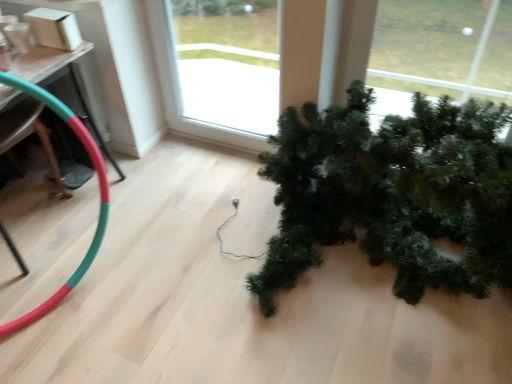
Image resolution: width=512 pixels, height=384 pixels. In order to click on free spot to the left of green matte christmas tree at lower right in this screenshot , I will do `click(176, 259)`.